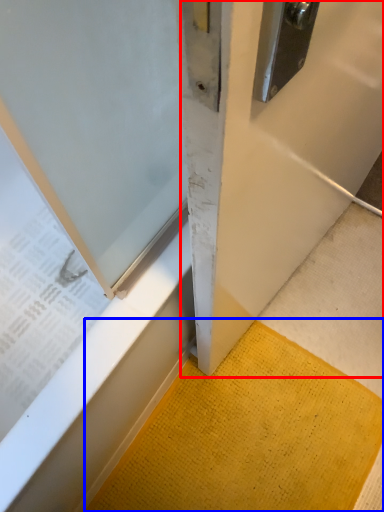
Question: Among these objects, which one is farthest to the camera, door (highlighted by a red box) or doormat (highlighted by a blue box)?

Choices:
 (A) door
 (B) doormat

Answer: (B)